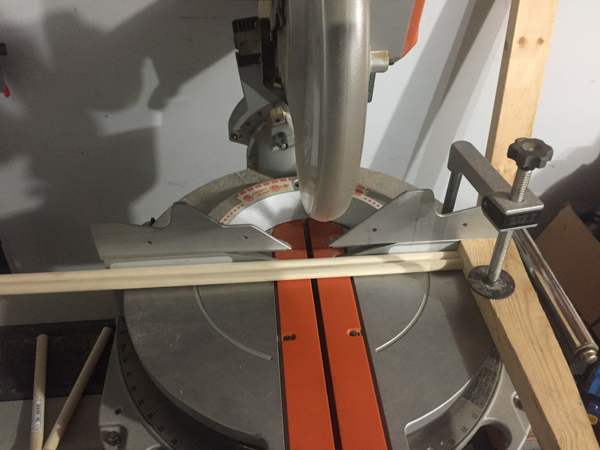
At what (x,y) coordinates should I click in order to perform the action: click on knob. Please return your answer as a coordinate pair (x, y). Looking at the image, I should click on (532, 147).